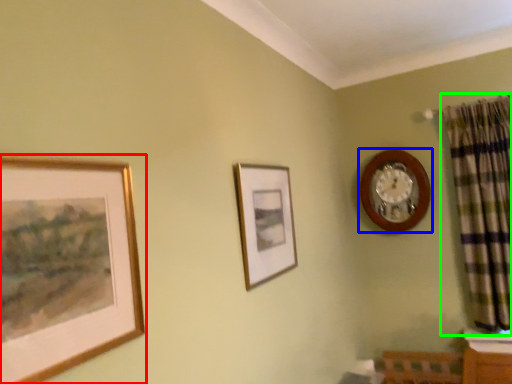
Question: Which object is positioned farthest from picture frame (highlighted by a red box)? Select from wall clock (highlighted by a blue box) and curtain (highlighted by a green box).

Choices:
 (A) wall clock
 (B) curtain

Answer: (B)